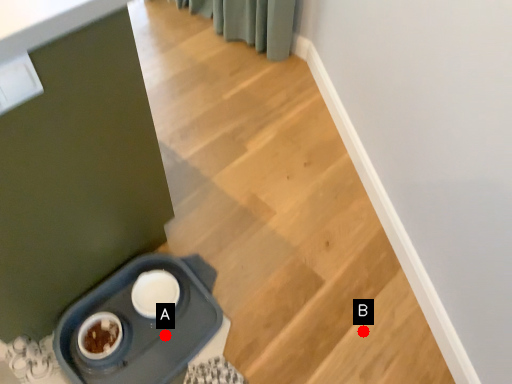
Question: Two points are circled on the image, labeled by A and B beside each circle. Among these points, which one is farthest from the camera?

Choices:
 (A) A is further
 (B) B is further

Answer: (B)